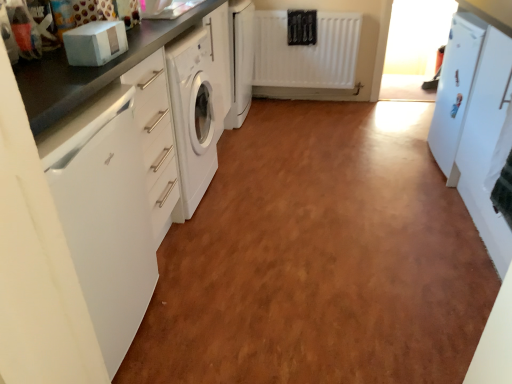
Where is `free location in front of white glossy washing machine at center, the second cabinetry when ordered from front to back`? This screenshot has width=512, height=384. free location in front of white glossy washing machine at center, the second cabinetry when ordered from front to back is located at coordinates (256, 135).